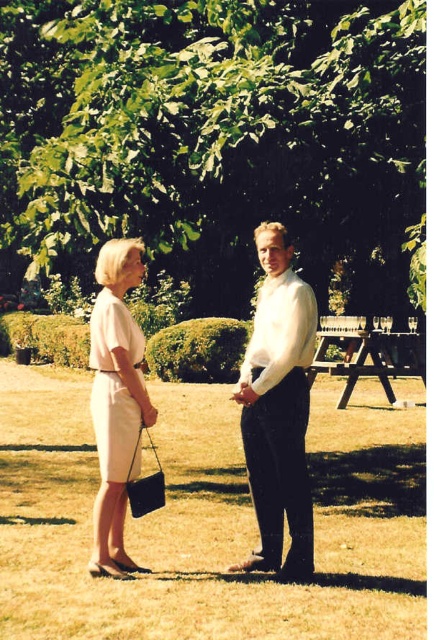
Looking at this image, you are planning a photoshoot in the garden and need to decide which dress to feature. Both the light beige fabric dress at center and the matte white dress at center are available. Considering their heights, which dress would appear more prominent in the photo?

The light beige fabric dress at center is taller than the matte white dress at center, so it would appear more prominent in the photo.

You are planning to take a photo of the two people in the garden. You want to focus on the white smooth shirt at center and the matte white dress at center. Which one will appear larger in the photo?

The white smooth shirt at center will appear larger in the photo because it is closer to the viewer than the matte white dress at center.

You are planning to lay out a picnic blanket in the garden. The picnic blanket is 2 meters by 2 meters. You see the green grass at center and the light beige fabric dress at center. Which area can accommodate the picnic blanket without overlapping the dress?

The green grass at center is larger in size than the light beige fabric dress at center, so the picnic blanket can be placed on the green grass at center as it has enough space.